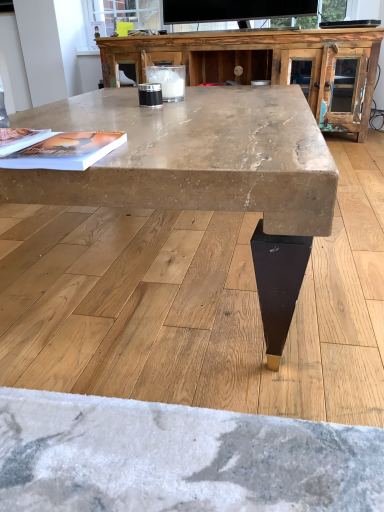
I want to click on vacant location below marble-like wood coffee table at center (from a real-world perspective), so click(147, 260).